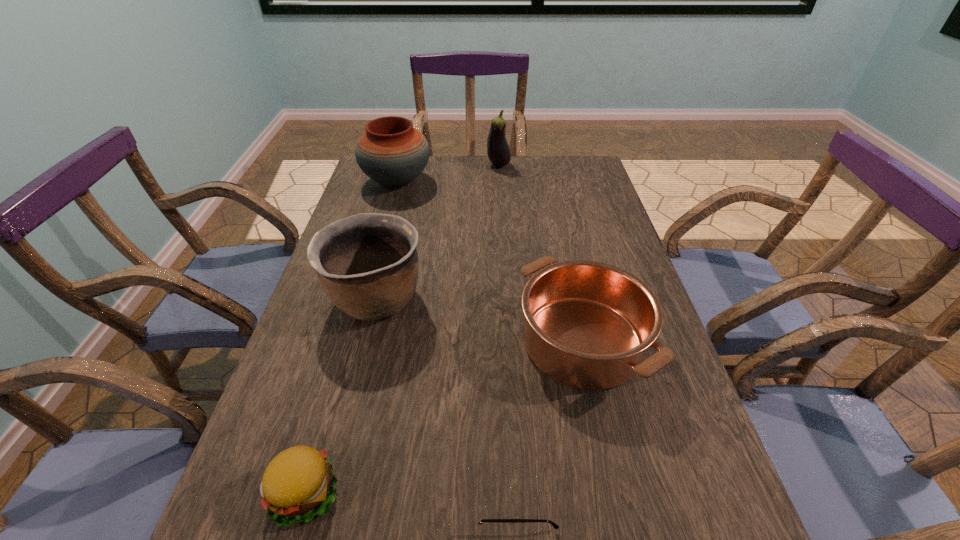
Find the location of a particular element. This screenshot has width=960, height=540. unoccupied area between the nearer pottery and the eggplant is located at coordinates (437, 232).

You are a GUI agent. You are given a task and a screenshot of the screen. Output one action in this format:
    pyautogui.click(x=<x>, y=<y>)
    Task: Click on the free space between the hamburger and the farther pottery
    The height and width of the screenshot is (540, 960).
    Given the screenshot: What is the action you would take?
    pyautogui.click(x=350, y=337)

Locate an element on the screen. Image resolution: width=960 pixels, height=540 pixels. vacant space that's between the fourth tallest object and the nearer pottery is located at coordinates (479, 320).

Identify the location of free space between the eggplant and the farther pottery. Image resolution: width=960 pixels, height=540 pixels. [x=447, y=173].

The image size is (960, 540). Identify the location of vacant region between the second shortest object and the saucepan. (444, 417).

Identify which object is the second nearest to the nearer pottery. Please provide its 2D coordinates. Your answer should be formatted as a tuple, i.e. [(x, y)], where the tuple contains the x and y coordinates of a point satisfying the conditions above.

[(299, 482)]

Identify the location of object that stands as the third closest to the hamburger. (588, 324).

Locate an element on the screen. The image size is (960, 540). vacant space that satisfies the following two spatial constraints: 1. on the back side of the farther pottery; 2. on the right side of the eggplant is located at coordinates (401, 165).